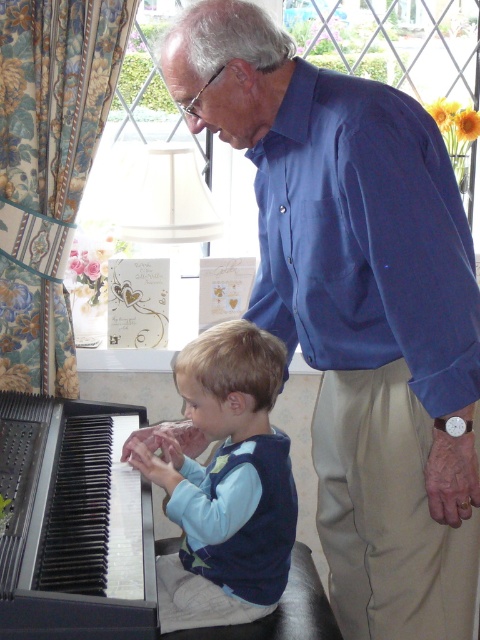
You are standing at the point marked as point (288, 337). The window with floral patterned curtain on the left is your destination. Can you reach it without moving more than 1.7 meters?

→ Yes, because the distance between you and the window with floral patterned curtain on the left is exactly 1.74 meters, which is within the 1.7 meter limit.

You are a photographer trying to capture the blue shirt at upper center and the black plastic piano at lower left in a single frame. Based on their sizes, which object would appear larger in the photo?

The blue shirt at upper center would appear larger in the photo since its width is larger than the black plastic piano at lower left.